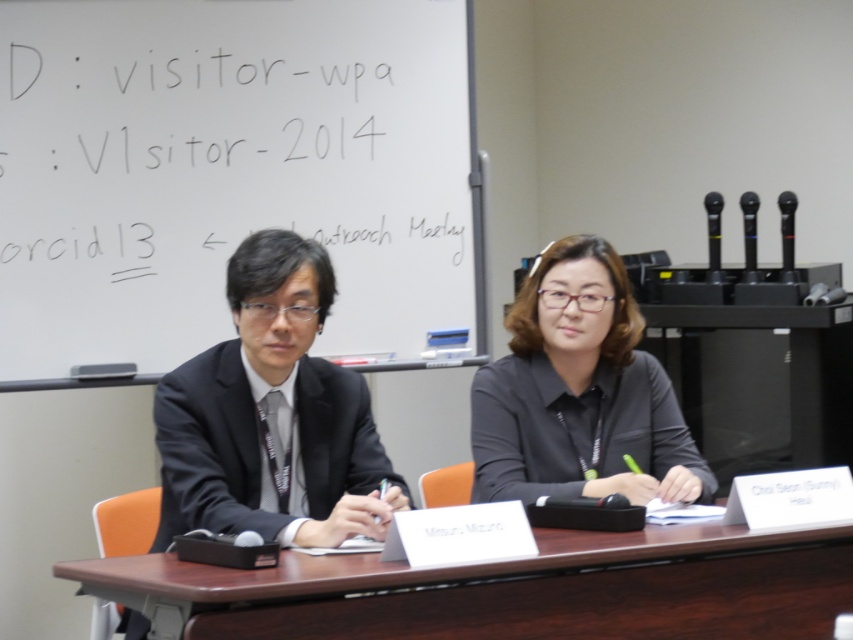
Which is behind, point (306, 172) or point (321, 490)?

The point (306, 172) is more distant.

Consider the image. Is whiteboard at upper left behind black suit at center?

Yes, it is behind black suit at center.

Is point (173, 60) less distant than point (340, 509)?

No, (173, 60) is behind (340, 509).

You are a GUI agent. You are given a task and a screenshot of the screen. Output one action in this format:
    pyautogui.click(x=<x>, y=<y>)
    Task: Click on the whiteboard at upper left
    
    Given the screenshot: What is the action you would take?
    pyautogui.click(x=233, y=179)

Can you confirm if brown wood table at center is positioned to the right of black suit at center?

Correct, you'll find brown wood table at center to the right of black suit at center.

Is brown wood table at center smaller than black suit at center?

Yes.

Which is in front, point (592, 572) or point (169, 520)?

Positioned in front is point (592, 572).

You are a GUI agent. You are given a task and a screenshot of the screen. Output one action in this format:
    pyautogui.click(x=<x>, y=<y>)
    Task: Click on the brown wood table at center
    This screenshot has width=853, height=640.
    Given the screenshot: What is the action you would take?
    pyautogui.click(x=508, y=588)

Is point (399, 35) farther from camera compared to point (281, 556)?

That is True.

Is point (206, 243) behind point (618, 628)?

Yes, it is behind point (618, 628).

The width and height of the screenshot is (853, 640). Find the location of `whiteboard at upper left`. whiteboard at upper left is located at coordinates (233, 179).